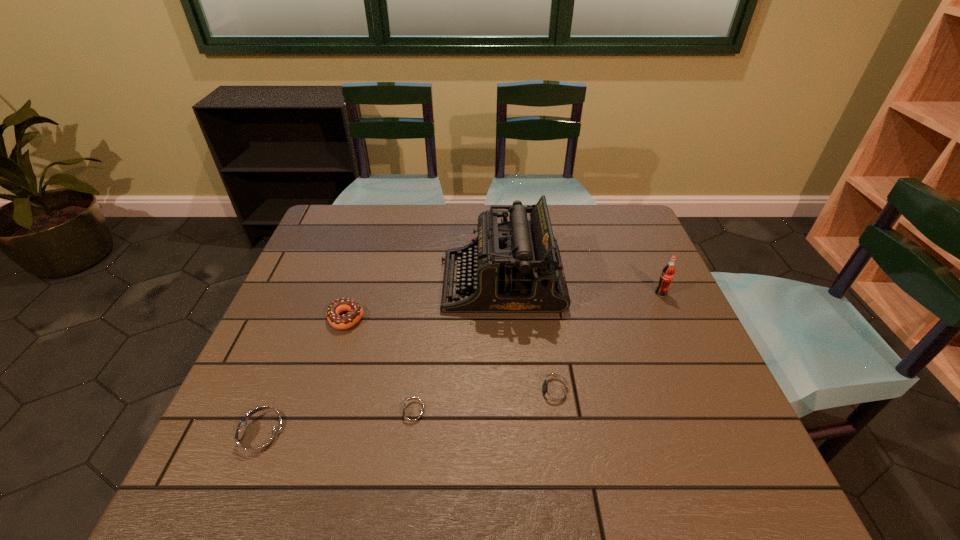
You are a GUI agent. You are given a task and a screenshot of the screen. Output one action in this format:
    pyautogui.click(x=<x>, y=<y>)
    Task: Click on the empty space that is in between the rightmost watch and the shortest object
    The height and width of the screenshot is (540, 960).
    Given the screenshot: What is the action you would take?
    pyautogui.click(x=484, y=403)

This screenshot has height=540, width=960. I want to click on vacant point located between the rightmost watch and the fifth shortest object, so click(x=608, y=343).

The image size is (960, 540). In order to click on free area in between the second watch from right to left and the tallest watch in this screenshot , I will do `click(336, 426)`.

Identify the location of free spot between the second shortest object and the doughnut. The width and height of the screenshot is (960, 540). pos(450,355).

Where is `free space that is in between the tallest object and the doughnut`? The image size is (960, 540). free space that is in between the tallest object and the doughnut is located at coordinates (423, 300).

The height and width of the screenshot is (540, 960). Find the location of `free area in between the tallest watch and the tallest object`. free area in between the tallest watch and the tallest object is located at coordinates (380, 360).

Locate an element on the screen. This screenshot has width=960, height=540. unoccupied area between the soda bottle and the rightmost watch is located at coordinates (608, 343).

Where is `empty space that is in between the fifth shortest object and the tallest watch`? The height and width of the screenshot is (540, 960). empty space that is in between the fifth shortest object and the tallest watch is located at coordinates (460, 365).

Where is `free space between the second tallest watch and the shortest object`? The image size is (960, 540). free space between the second tallest watch and the shortest object is located at coordinates (484, 403).

This screenshot has height=540, width=960. Find the location of `empty location between the leftmost watch and the tallest object`. empty location between the leftmost watch and the tallest object is located at coordinates pyautogui.click(x=380, y=360).